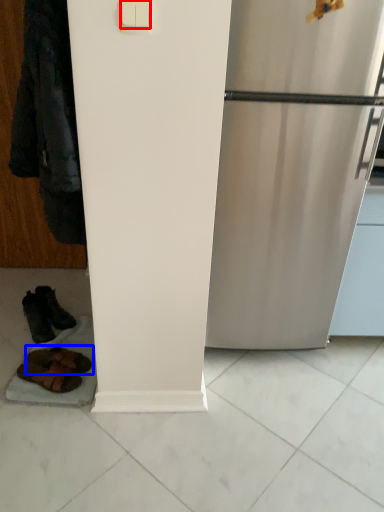
Question: Among these objects, which one is farthest to the camera, light switch (highlighted by a red box) or footwear (highlighted by a blue box)?

Choices:
 (A) light switch
 (B) footwear

Answer: (B)